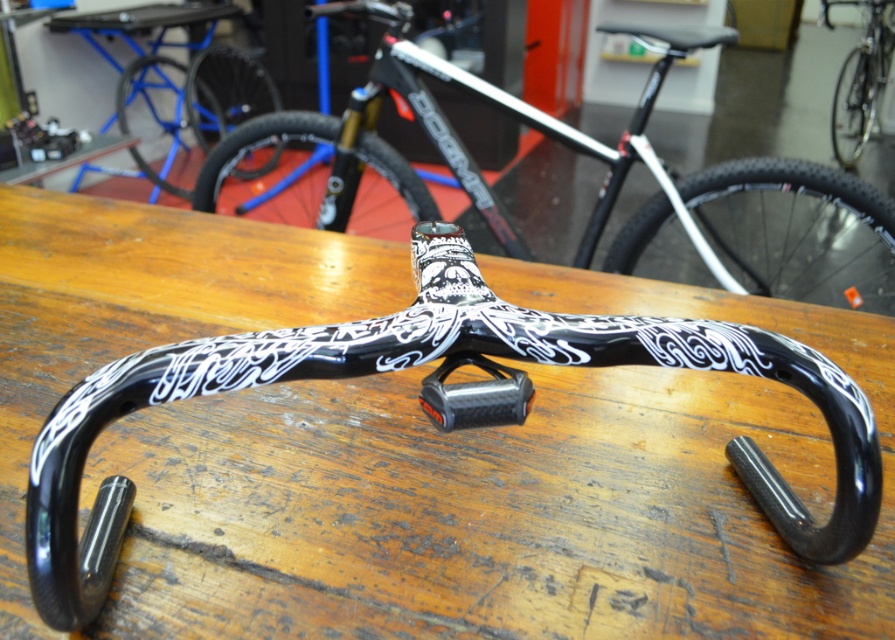
Question: Which of the following is the farthest from the observer?

Choices:
 (A) (457, 403)
 (B) (845, 168)
 (C) (96, 336)
 (D) (691, 205)

Answer: (B)

Question: Does wooden table at center lie in front of black glossy bicycle handlebar at center?

Choices:
 (A) no
 (B) yes

Answer: (B)

Question: Is black matte bicycle handlebar at center positioned before black glossy bicycle handlebar at center?

Choices:
 (A) no
 (B) yes

Answer: (B)

Question: Estimate the real-world distances between objects in this image. Which object is farther from the black matte bicycle handlebar at center?

Choices:
 (A) wooden table at center
 (B) black glossy bicycle handlebar at center
 (C) carbon fiber handlebar at center

Answer: (C)

Question: Is the position of wooden table at center less distant than that of carbon fiber handlebar at center?

Choices:
 (A) yes
 (B) no

Answer: (B)

Question: Based on their relative distances, which object is nearer to the black matte bicycle handlebar at center?

Choices:
 (A) carbon fiber handlebar at center
 (B) black glossy bicycle handlebar at center

Answer: (B)